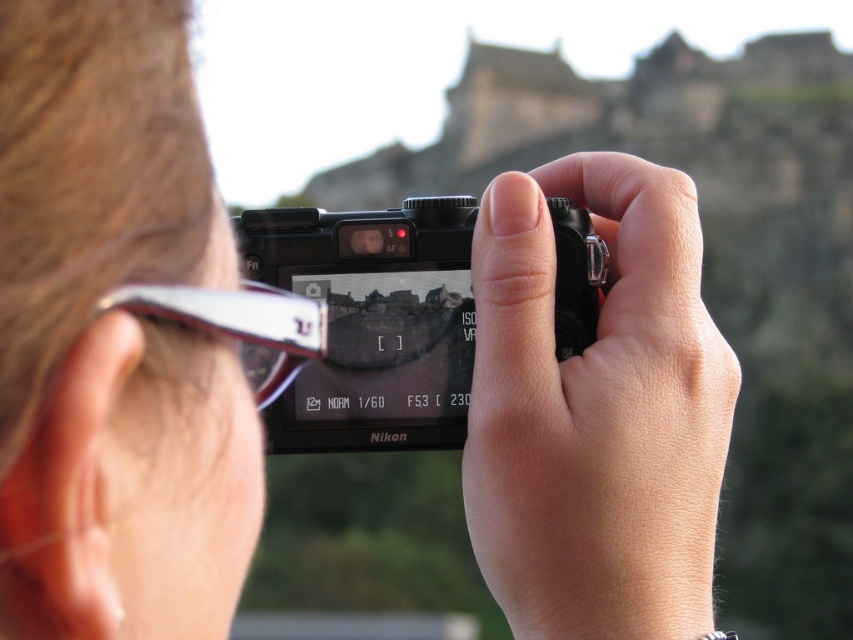
You are a photographer adjusting your camera settings. You notice two points in your viewfinder at coordinates point [646,524] and point [247,305]. Which point is closer to your camera lens?

Point [646,524] is further to the viewer than point [247,305], so the point closer to the camera lens is point [247,305].

What is the location of the point with coordinates point (596,412) in the scene?

The point with coordinates point (596,412) is located on the smooth skin hand at center.